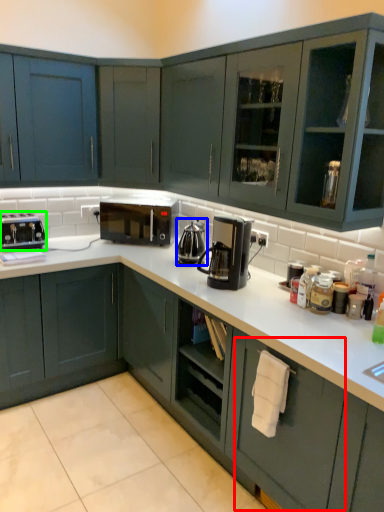
Question: Based on their relative distances, which object is nearer to drawer (highlighted by a red box)? Choose from coffeepot (highlighted by a blue box) and kitchen appliance (highlighted by a green box).

Choices:
 (A) coffeepot
 (B) kitchen appliance

Answer: (A)